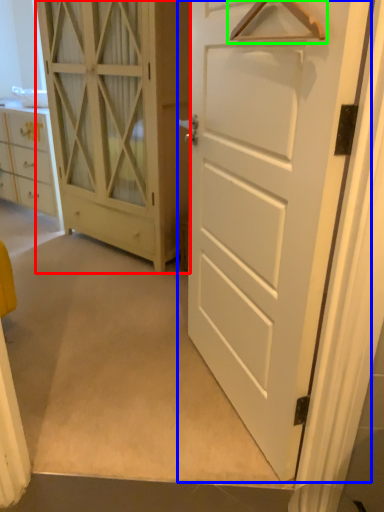
Question: Which object is positioned farthest from door (highlighted by a red box)? Select from door (highlighted by a blue box) and hanger (highlighted by a green box).

Choices:
 (A) door
 (B) hanger

Answer: (B)